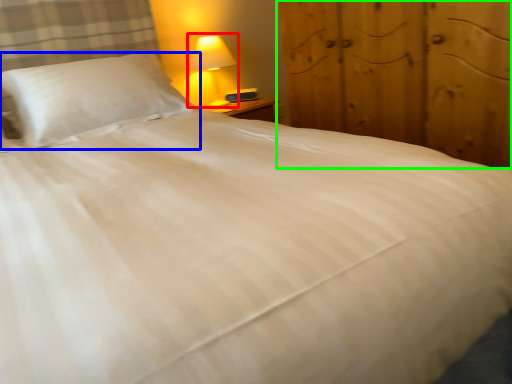
Question: Which object is positioned farthest from lamp (highlighted by a red box)? Select from pillow (highlighted by a blue box) and dresser (highlighted by a green box).

Choices:
 (A) pillow
 (B) dresser

Answer: (B)